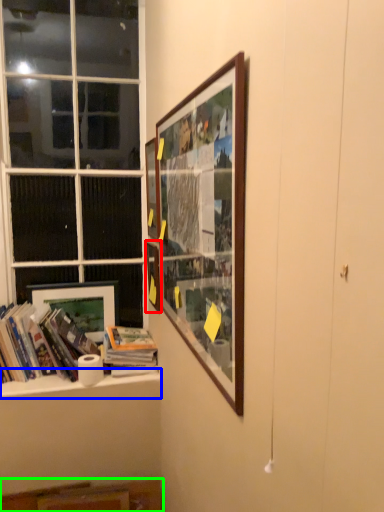
Question: Considering the real-world distances, which object is closest to picture frame (highlighted by a red box)? window sill (highlighted by a blue box) or cabinet (highlighted by a green box).

Choices:
 (A) window sill
 (B) cabinet

Answer: (A)